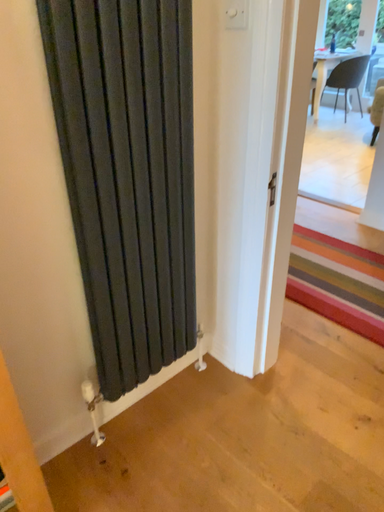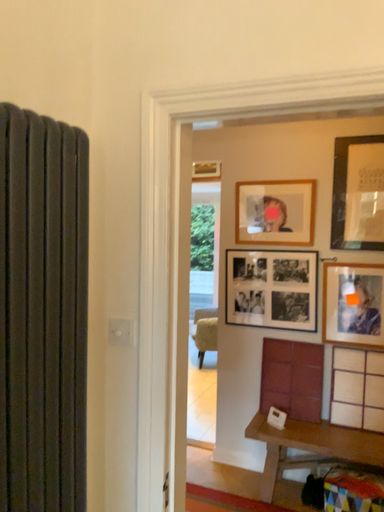
Question: Which way did the camera rotate in the video?

Choices:
 (A) rotated left
 (B) rotated right

Answer: (B)